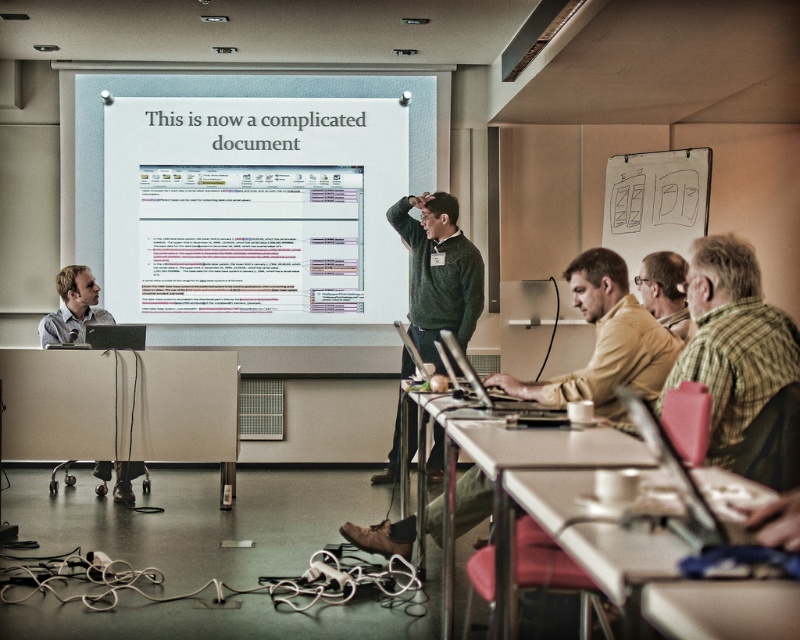
You are standing at the entrance of the classroom and want to move to the matte plastic table at lower left. Which direction should you walk to reach it?

The matte plastic table at lower left is located at point (x=121, y=406), so you should walk towards the lower left direction to reach it.

You are a student who needs to move from your current desk to the other table to borrow a notebook. The classroom has a 1.2 meter wide aisle between the desks. Can you walk from your matte plastic table at lower left to the beige plastic table at lower right without moving any desks?

The matte plastic table at lower left and beige plastic table at lower right are 3.85 meters apart. Since the aisle is 1.2 meters wide, which is sufficient for a person to walk through, you can walk from the matte plastic table at lower left to the beige plastic table at lower right without needing to move any desks.

You are organizing a small group activity in the classroom and need to place two tables side by side. Given the space constraints, which table from the matte plastic table at lower left and beige plastic table at lower right should you choose to accommodate more participants?

The matte plastic table at lower left has a larger width than the beige plastic table at lower right, so it can accommodate more participants.